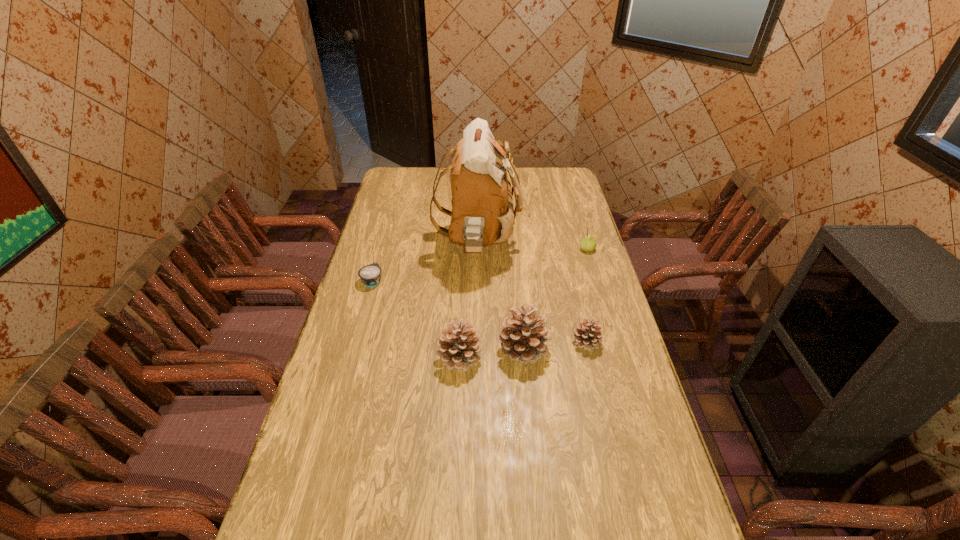
Find the location of `vacant space situated 0.140m on the left of the second pinecone from right to left`. vacant space situated 0.140m on the left of the second pinecone from right to left is located at coordinates (453, 350).

The image size is (960, 540). I want to click on blank space located 0.070m on the left of the rightmost pinecone, so click(x=549, y=342).

This screenshot has height=540, width=960. In order to click on vacant space situated 0.090m on the front-facing side of the tallest object in this screenshot , I will do tap(542, 244).

The image size is (960, 540). I want to click on free space located on the left of the rightmost object, so click(509, 249).

Where is `free space located on the right of the yogurt`? The image size is (960, 540). free space located on the right of the yogurt is located at coordinates (405, 281).

The image size is (960, 540). Identify the location of object located at the left edge. (370, 275).

I want to click on pinecone at the right edge, so click(587, 335).

This screenshot has width=960, height=540. I want to click on pear situated at the right edge, so click(x=588, y=243).

The image size is (960, 540). Find the location of `free space at the far edge of the desktop`. free space at the far edge of the desktop is located at coordinates (522, 171).

The height and width of the screenshot is (540, 960). What are the coordinates of `free spot at the near edge of the desktop` in the screenshot? It's located at (374, 518).